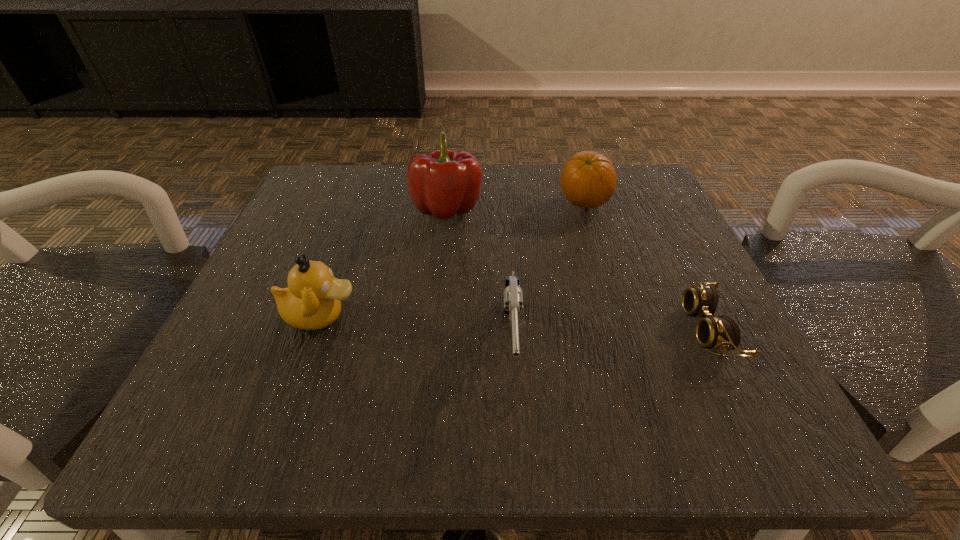
Locate an element on the screen. free space between the fourth object from left to right and the third object from left to right is located at coordinates (547, 273).

Locate an element on the screen. The height and width of the screenshot is (540, 960). free area in between the shortest object and the orange is located at coordinates (646, 266).

Where is `free space between the goggles and the pepper`? The image size is (960, 540). free space between the goggles and the pepper is located at coordinates (578, 269).

Where is `free space between the orange and the pepper`? Image resolution: width=960 pixels, height=540 pixels. free space between the orange and the pepper is located at coordinates (516, 206).

Locate an element on the screen. empty location between the third object from right to left and the duckling is located at coordinates (416, 329).

In order to click on blank region between the leftmost object and the third object from left to right in this screenshot , I will do `click(416, 329)`.

The width and height of the screenshot is (960, 540). I want to click on object that is the second closest to the third object from right to left, so click(x=312, y=301).

The image size is (960, 540). I want to click on the fourth closest object to the third object from left to right, so click(x=722, y=332).

Where is `vacant space that satisfies the following two spatial constraints: 1. on the front side of the pepper; 2. on the face of the duckling`? The height and width of the screenshot is (540, 960). vacant space that satisfies the following two spatial constraints: 1. on the front side of the pepper; 2. on the face of the duckling is located at coordinates (436, 315).